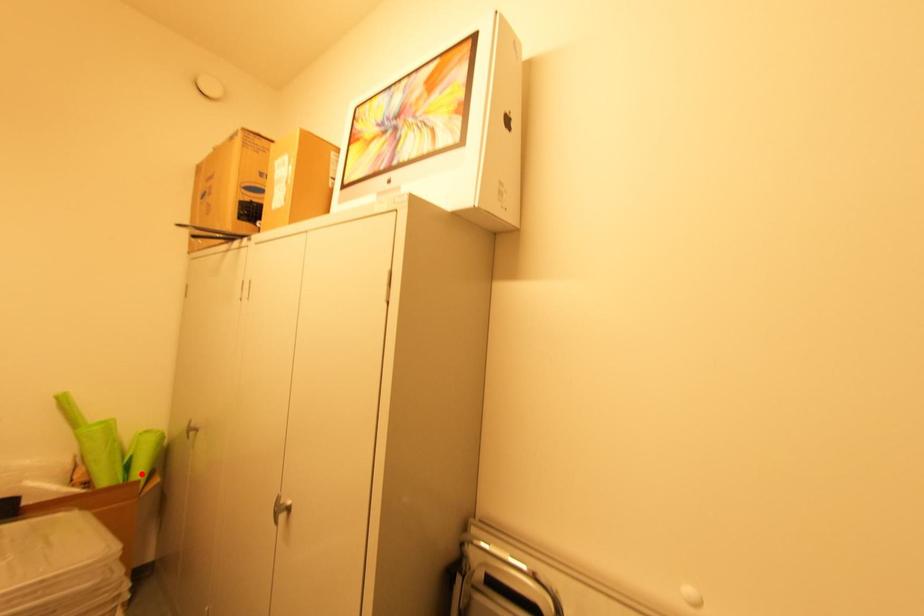
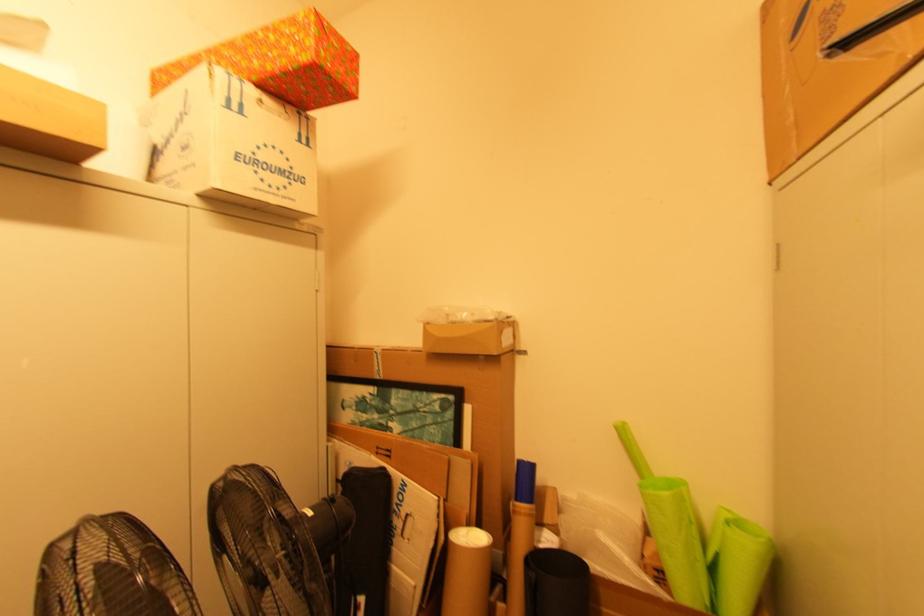
Question: I am providing you with two images of the same scene from different viewpoints. A red point is marked on the first image. Can you still see the location of the red point in image 2?

Choices:
 (A) Yes
 (B) No

Answer: (A)